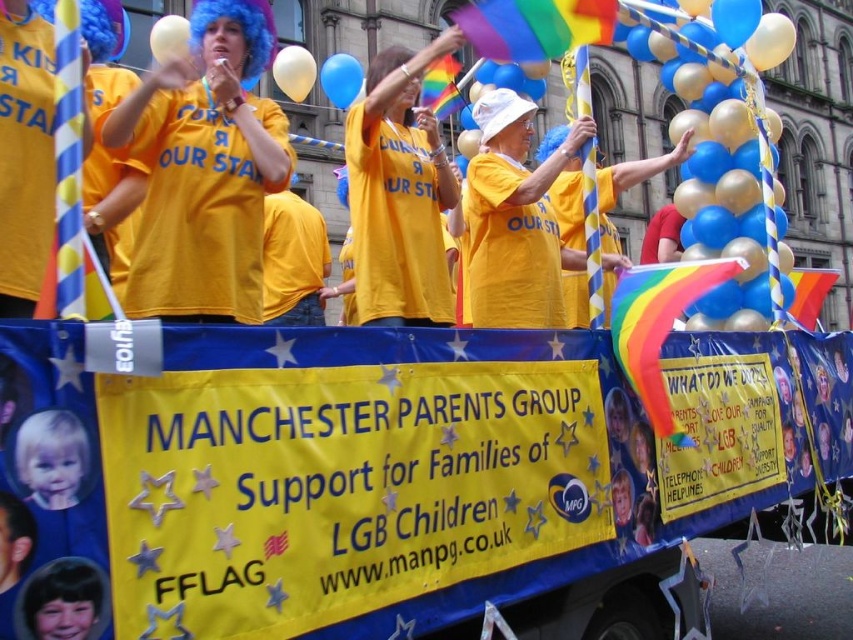
Who is lower down, yellow matte shirt at center or blue glossy balloon at upper center?

yellow matte shirt at center

Who is higher up, yellow matte shirt at center or blue glossy balloon at upper center?

blue glossy balloon at upper center

Is point (393, 204) in front of point (341, 60)?

That is True.

I want to click on yellow matte shirt at center, so click(x=399, y=193).

Based on the photo, does blonde hair at lower left appear under white matte balloon at upper left?

Indeed, blonde hair at lower left is positioned under white matte balloon at upper left.

You are a GUI agent. You are given a task and a screenshot of the screen. Output one action in this format:
    pyautogui.click(x=<x>, y=<y>)
    Task: Click on the blonde hair at lower left
    The image size is (853, 640).
    Given the screenshot: What is the action you would take?
    pyautogui.click(x=51, y=458)

Who is more forward, [775,209] or [164,49]?

Point [164,49] is more forward.

Between blue metallic balloons at upper right and white matte balloon at upper left, which one appears on the right side from the viewer's perspective?

blue metallic balloons at upper right is more to the right.

Between point (782, 51) and point (166, 19), which one is positioned behind?

The point (782, 51) is more distant.

Where is `blue metallic balloons at upper right`? blue metallic balloons at upper right is located at coordinates (730, 156).